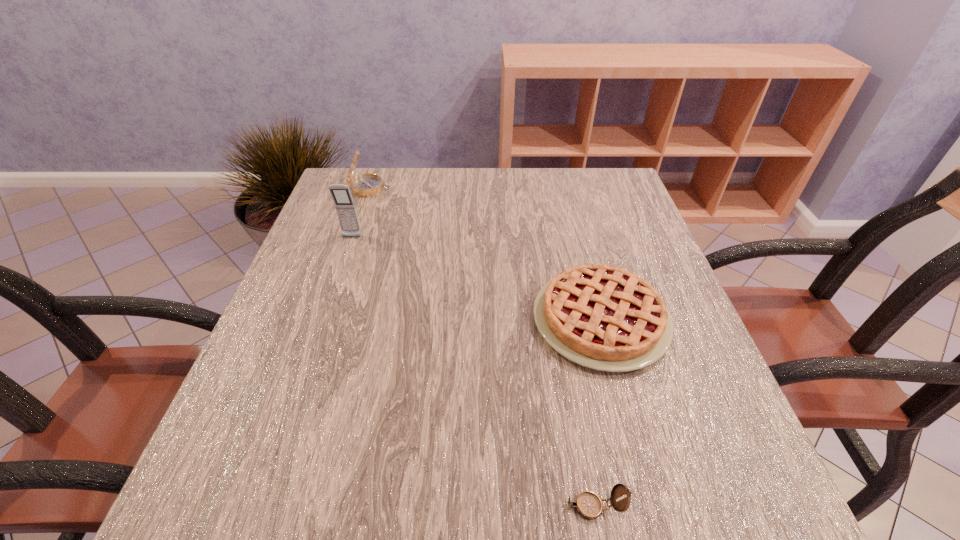
The width and height of the screenshot is (960, 540). In the image, there is a desktop. In order to click on free space at the near edge in this screenshot , I will do `click(461, 482)`.

In the image, there is a desktop. Find the location of `vacant area at the left edge`. vacant area at the left edge is located at coordinates (343, 246).

Where is `vacant space at the far left corner of the desktop`? The image size is (960, 540). vacant space at the far left corner of the desktop is located at coordinates (340, 184).

Find the location of a particular element. free space at the far right corner of the desktop is located at coordinates (605, 181).

Where is `vacant area that lies between the taller compass and the third farthest object`? vacant area that lies between the taller compass and the third farthest object is located at coordinates (485, 254).

Locate an element on the screen. The width and height of the screenshot is (960, 540). free space between the third nearest object and the right compass is located at coordinates (472, 372).

The width and height of the screenshot is (960, 540). In order to click on free area in between the tallest object and the left compass in this screenshot , I will do `click(361, 213)`.

The height and width of the screenshot is (540, 960). I want to click on vacant area between the third farthest object and the taller compass, so click(x=485, y=254).

At what (x,y) coordinates should I click in order to perform the action: click on vacant area between the third nearest object and the nearest object. Please return your answer as a coordinate pair (x, y). The height and width of the screenshot is (540, 960). Looking at the image, I should click on (472, 372).

Where is `free spot between the farthest object and the cellular telephone`? The width and height of the screenshot is (960, 540). free spot between the farthest object and the cellular telephone is located at coordinates (361, 213).